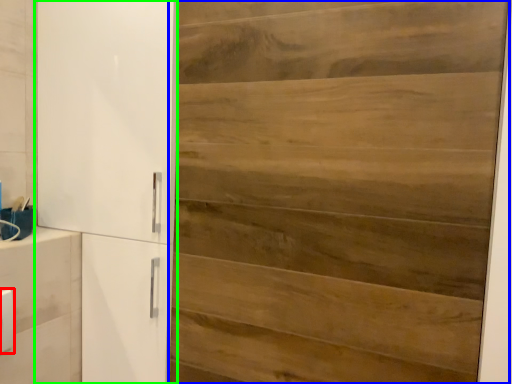
Question: Which object is positioned closest to light switch (highlighted by a red box)? Select from door (highlighted by a blue box) and cupboard (highlighted by a green box).

Choices:
 (A) door
 (B) cupboard

Answer: (B)